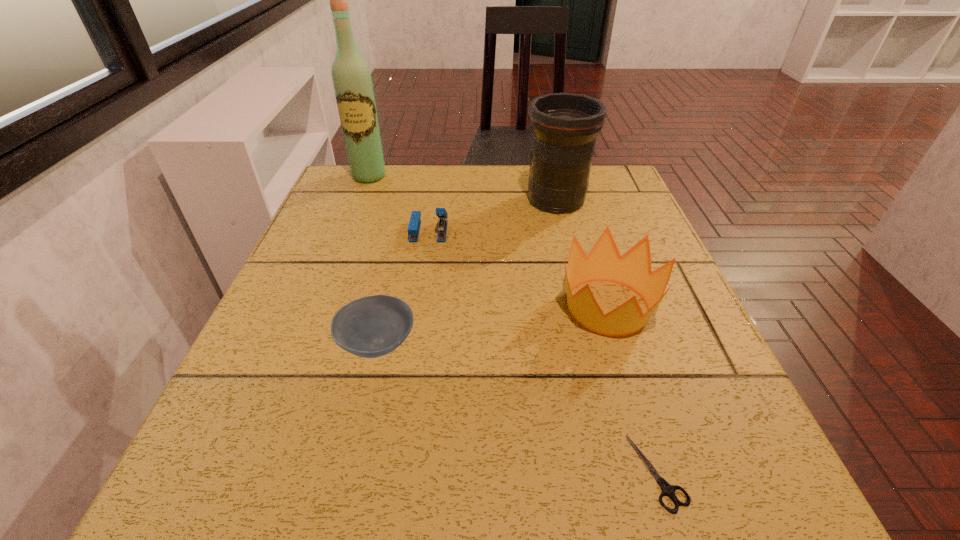
Where is `vacant space located 0.080m on the left of the second tallest object`? The width and height of the screenshot is (960, 540). vacant space located 0.080m on the left of the second tallest object is located at coordinates (491, 200).

At what (x,y) coordinates should I click in order to perform the action: click on blank space located 0.230m on the front of the crown. Please return your answer as a coordinate pair (x, y). The width and height of the screenshot is (960, 540). Looking at the image, I should click on (662, 485).

Image resolution: width=960 pixels, height=540 pixels. Find the location of `vacant space located 0.320m on the right of the third farthest object`. vacant space located 0.320m on the right of the third farthest object is located at coordinates (590, 231).

Locate an element on the screen. free spot located 0.240m on the back of the second shortest object is located at coordinates (401, 238).

Locate an element on the screen. This screenshot has height=540, width=960. free point located on the left of the shears is located at coordinates (521, 472).

The image size is (960, 540). In order to click on wine bottle positioned at the far edge in this screenshot , I will do `click(352, 82)`.

Locate an element on the screen. telephoto lens located at the far edge is located at coordinates (564, 126).

Find the location of a particular element. This screenshot has width=960, height=540. object that is positioned at the near edge is located at coordinates (668, 490).

Where is `wine bottle at the left edge`? This screenshot has height=540, width=960. wine bottle at the left edge is located at coordinates (352, 82).

Identify the location of bowl that is at the left edge. (373, 326).